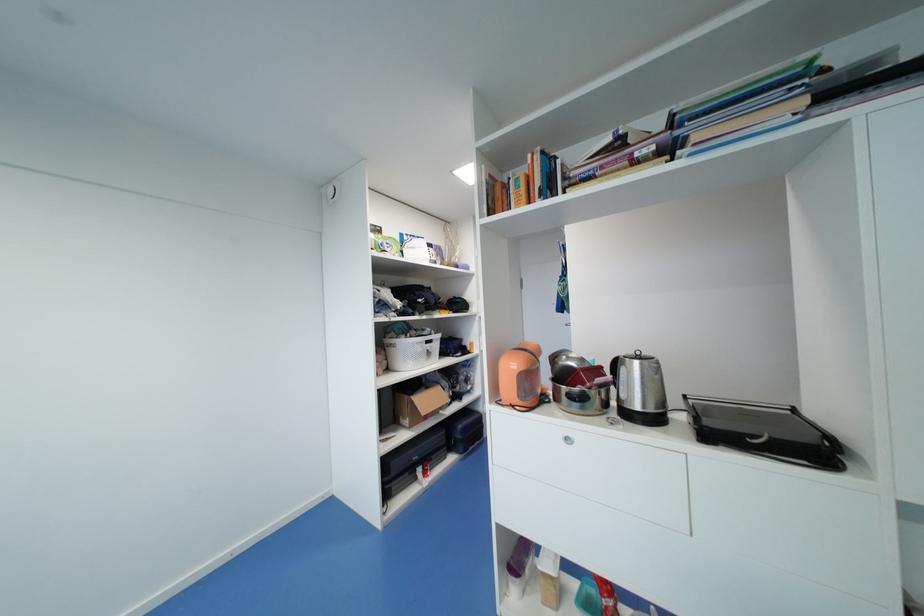
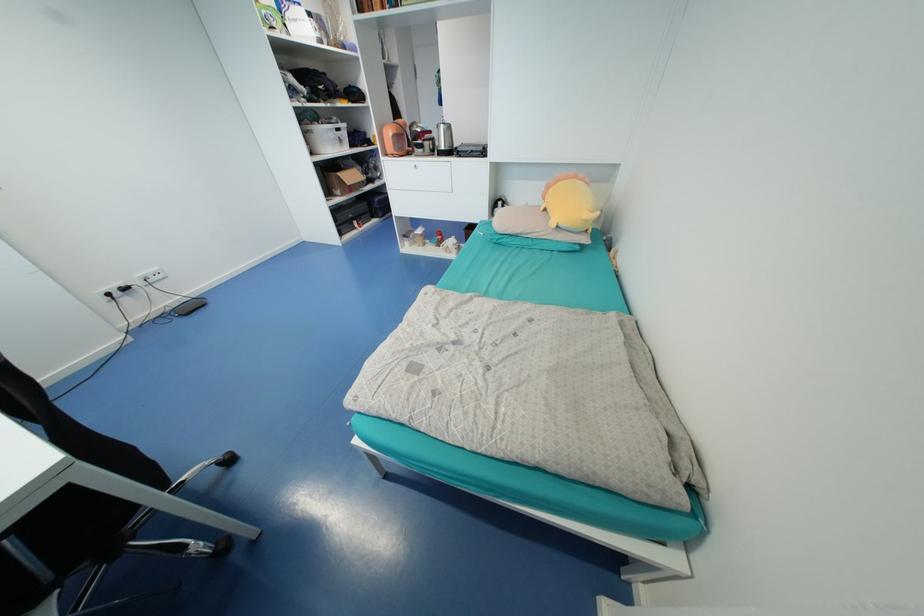
In the second image, find the point that corresponds to (x=433, y=354) in the first image.

(345, 140)